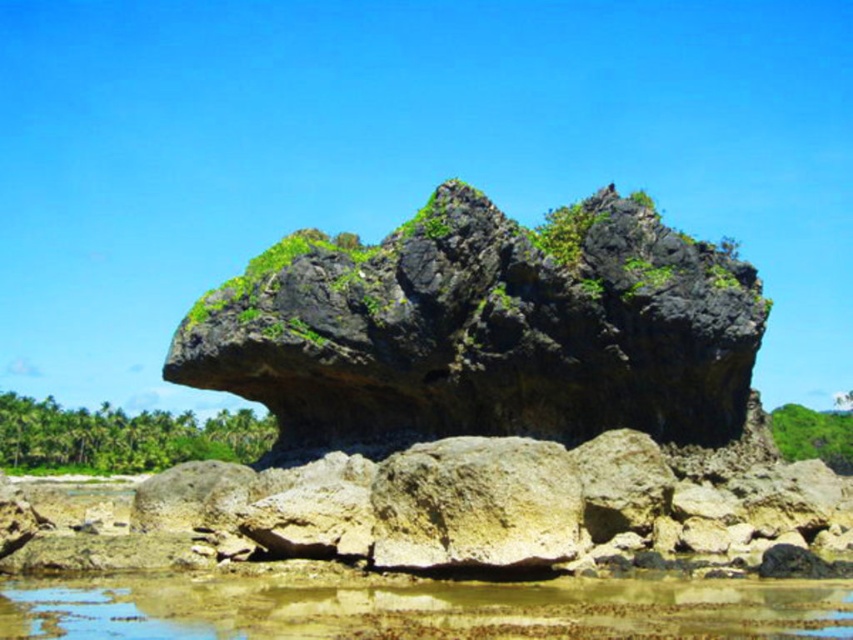
Who is shorter, green mossy rock at center or clear water at lower center?

clear water at lower center

Between point (289, 364) and point (349, 605), which one is positioned in front?

Point (349, 605) is more forward.

What do you see at coordinates (485, 330) in the screenshot?
I see `green mossy rock at center` at bounding box center [485, 330].

The image size is (853, 640). What are the coordinates of `green mossy rock at center` in the screenshot? It's located at (485, 330).